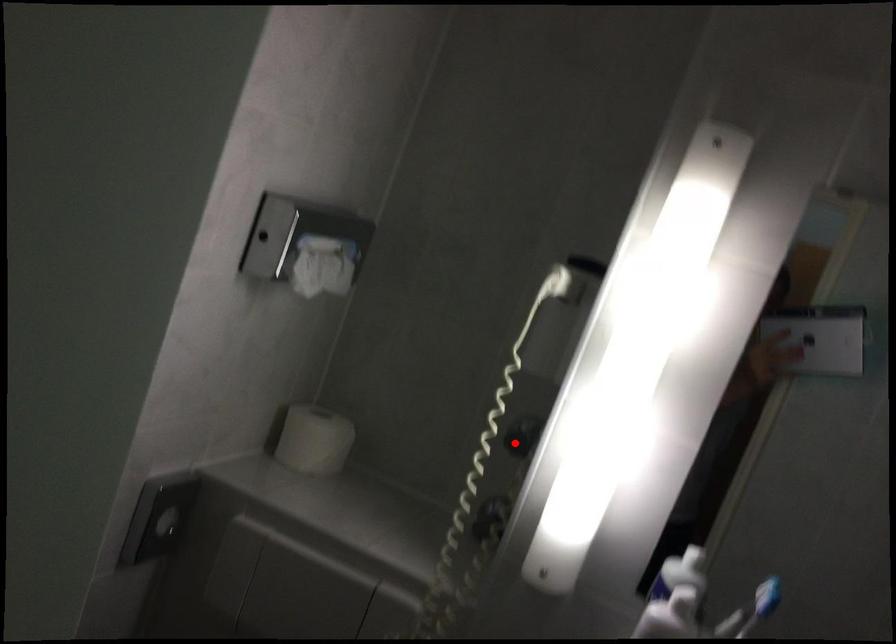
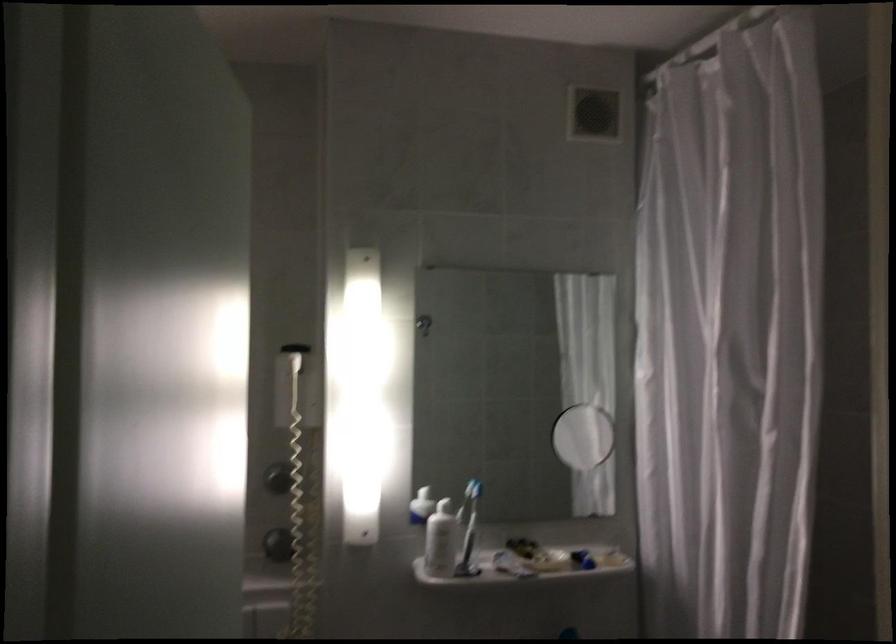
Locate, in the second image, the point that corresponds to the highlighted location in the first image.

(278, 478)